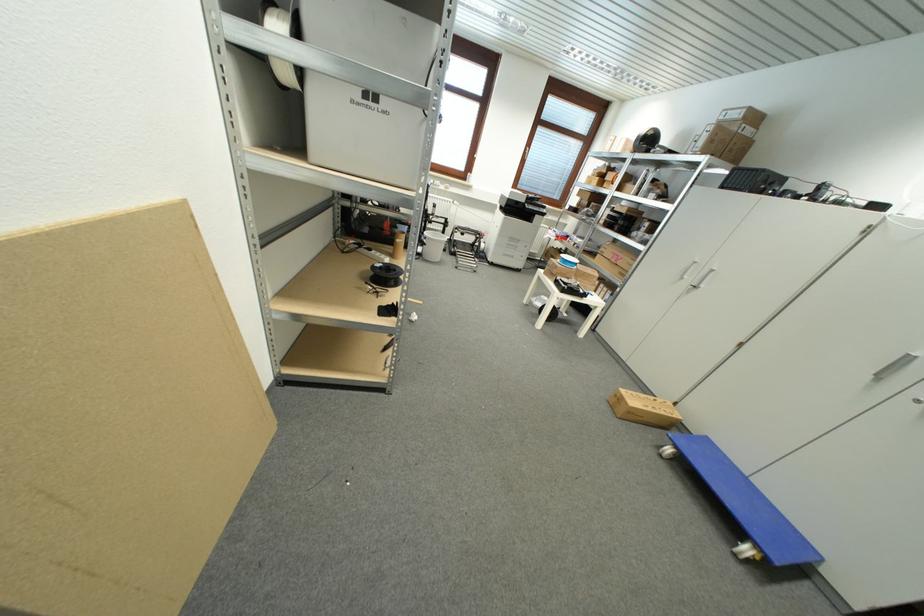
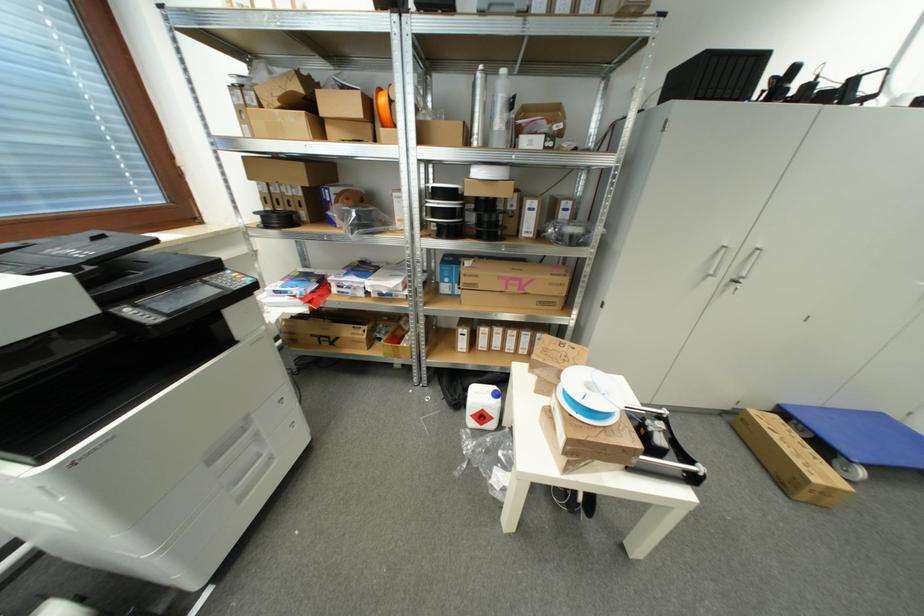
The point at (650, 190) is marked in the first image. Where is the corresponding point in the second image?

(504, 126)